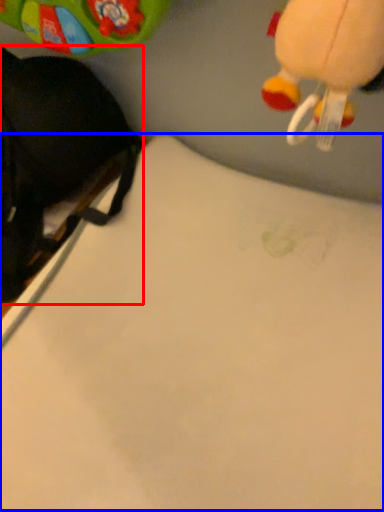
Question: Which object appears farthest to the camera in this image, toy (highlighted by a red box) or sheet (highlighted by a blue box)?

Choices:
 (A) toy
 (B) sheet

Answer: (A)